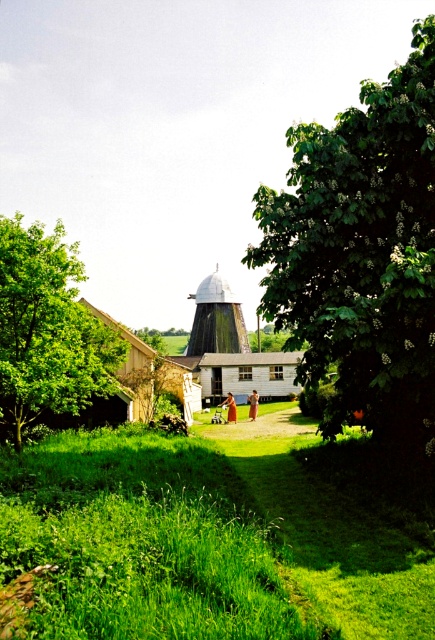
In the scene shown: Does green grassy at center appear on the right side of white matte silo at center?

Indeed, green grassy at center is positioned on the right side of white matte silo at center.

Which is below, green grassy at center or white matte silo at center?

green grassy at center is below.

The image size is (435, 640). Describe the element at coordinates (200, 544) in the screenshot. I see `green grassy at center` at that location.

Identify the location of green grassy at center. This screenshot has height=640, width=435. (200, 544).

Is green leafy tree at left bigger than white matte silo at center?

Yes.

Image resolution: width=435 pixels, height=640 pixels. In order to click on green leafy tree at left in this screenshot , I will do `click(47, 330)`.

Which is behind, point (33, 374) or point (203, 324)?

Positioned behind is point (203, 324).

Locate an element on the screen. The height and width of the screenshot is (640, 435). green leafy tree at left is located at coordinates (47, 330).

Is green grassy at center shorter than green leafy tree at center right?

Indeed, green grassy at center has a lesser height compared to green leafy tree at center right.

Does point (160, 488) come behind point (323, 150)?

No, it is in front of (323, 150).

This screenshot has width=435, height=640. I want to click on green grassy at center, so click(200, 544).